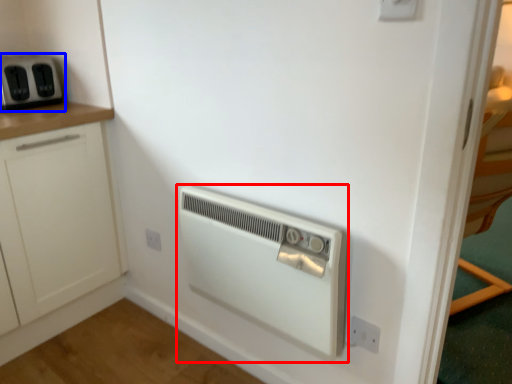
Question: Which object is further to the camera taking this photo, home appliance (highlighted by a red box) or home appliance (highlighted by a blue box)?

Choices:
 (A) home appliance
 (B) home appliance

Answer: (B)